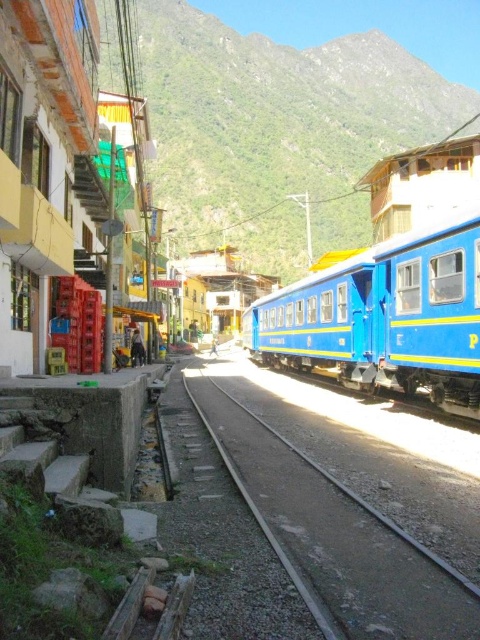
You are a hiker standing at the edge of the gray gravel track at center in the mountainous town. You want to take a photo of the green leafy mountain at upper center. Can you see the mountain clearly from your current position on the track?

The gray gravel track at center is behind green leafy mountain at upper center, so if you are standing on the gray gravel track at center, you would be positioned behind the green leafy mountain at upper center. This means the mountain would be between you and the view, making it impossible to see the mountain from your current position on the track.

You are a photographer standing in the middle of the street and want to capture both the green leafy mountain at upper center and the blue matte train at right in a single shot. Which object should you focus on first to ensure both are in focus?

You should focus on the green leafy mountain at upper center first because it is closer to you than the blue matte train at right, so adjusting focus from near to far will help both be in focus.

You are a photographer standing at the edge of the street facing the green leafy mountain at upper center and the gray gravel track at center. Which object would appear larger in your camera viewfinder?

The green leafy mountain at upper center would appear larger in the camera viewfinder because it is much taller than the gray gravel track at center.